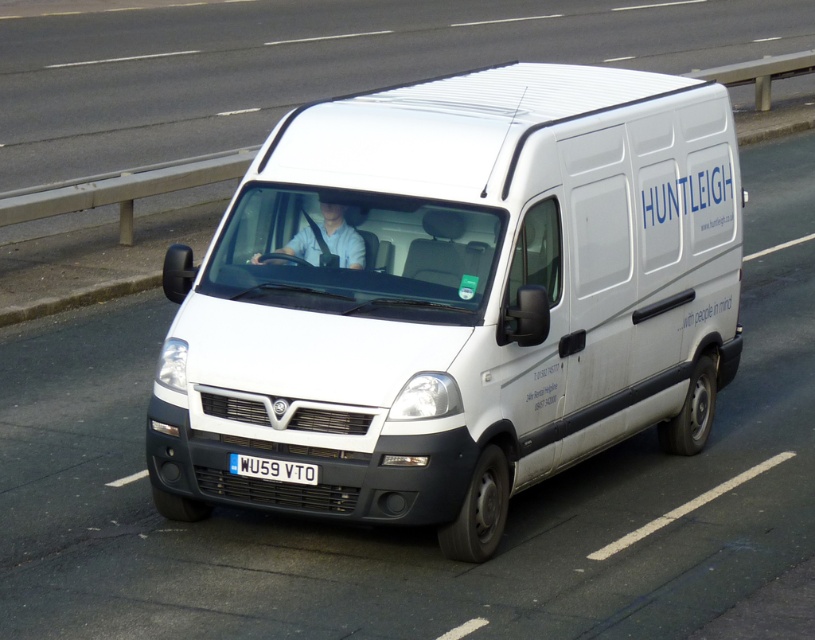
Question: Which of the following is the closest to the observer?

Choices:
 (A) (615, 202)
 (B) (298, 474)

Answer: (B)

Question: Is the position of white matte van at center less distant than that of white van at center?

Choices:
 (A) no
 (B) yes

Answer: (B)

Question: Does white van at center appear under white plastic license plate at center?

Choices:
 (A) no
 (B) yes

Answer: (A)

Question: Which object is the closest to the white plastic license plate at center?

Choices:
 (A) white van at center
 (B) white matte van at center

Answer: (B)

Question: Considering the real-world distances, which object is farthest from the white matte van at center?

Choices:
 (A) white van at center
 (B) white plastic license plate at center

Answer: (A)

Question: Does white matte van at center appear over white van at center?

Choices:
 (A) yes
 (B) no

Answer: (B)